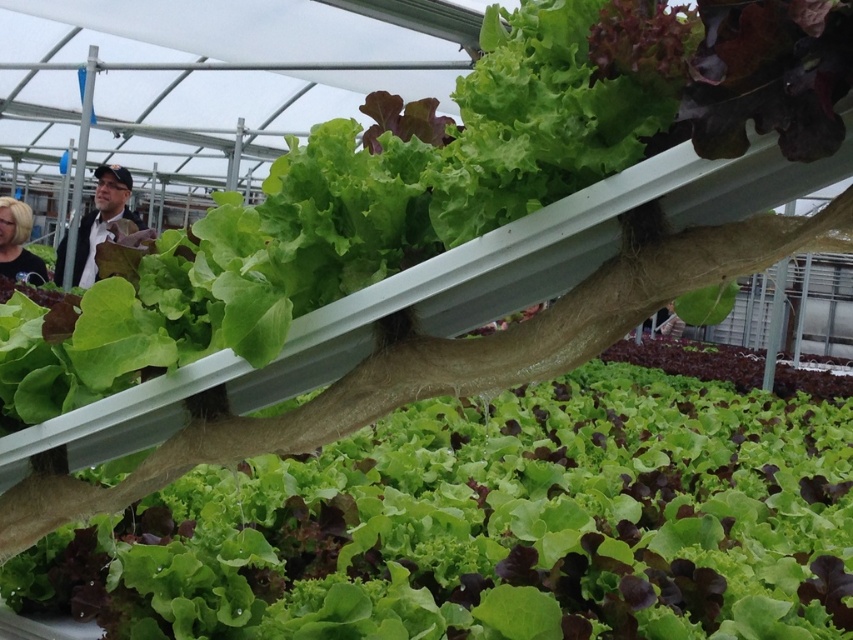
Is matte black jacket at upper left positioned at the back of blonde hair at left?

That is False.

Is matte black jacket at upper left to the left of blonde hair at left from the viewer's perspective?

In fact, matte black jacket at upper left is to the right of blonde hair at left.

Between point (80, 230) and point (6, 211), which one is positioned behind?

Point (80, 230)

Where is `matte black jacket at upper left`? The image size is (853, 640). matte black jacket at upper left is located at coordinates (102, 220).

Who is taller, blonde hair at left or matte black shirt at center?

Standing taller between the two is blonde hair at left.

Does point (9, 234) come closer to viewer compared to point (665, 337)?

That is True.

The height and width of the screenshot is (640, 853). In order to click on blonde hair at left in this screenshot , I will do `click(16, 243)`.

Is the position of matte black jacket at upper left less distant than that of matte black shirt at center?

No, matte black jacket at upper left is behind matte black shirt at center.

Who is more forward, (96,200) or (672,307)?

Positioned in front is point (672,307).

What do you see at coordinates (102, 220) in the screenshot?
I see `matte black jacket at upper left` at bounding box center [102, 220].

This screenshot has width=853, height=640. Find the location of `matte black jacket at upper left`. matte black jacket at upper left is located at coordinates (102, 220).